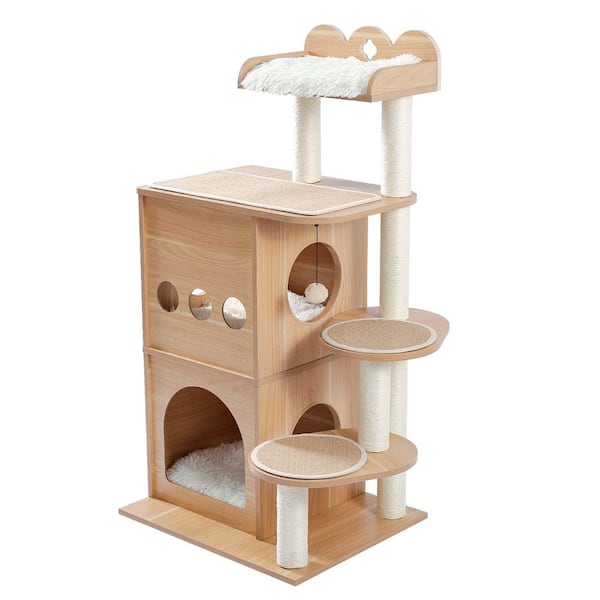
Where is `decorative cutout`? decorative cutout is located at coordinates tap(371, 44).